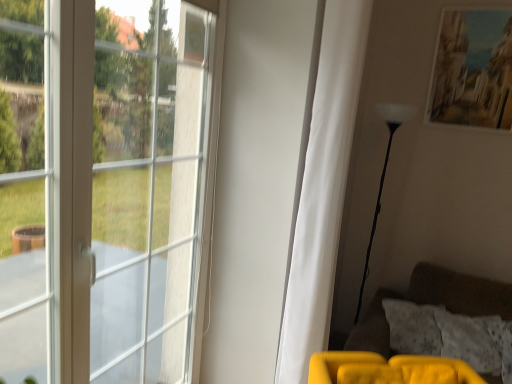
Question: Should I look upward or downward to see white glass window at left?

Choices:
 (A) down
 (B) up

Answer: (A)

Question: Is white glass window at left thinner than white glossy floor lamp at right?

Choices:
 (A) yes
 (B) no

Answer: (A)

Question: Is white glass window at left positioned in front of white glossy floor lamp at right?

Choices:
 (A) no
 (B) yes

Answer: (B)

Question: Is white glass window at left further to the viewer compared to white glossy floor lamp at right?

Choices:
 (A) yes
 (B) no

Answer: (B)

Question: Is white glossy floor lamp at right completely or partially inside white glass window at left?

Choices:
 (A) no
 (B) yes

Answer: (A)

Question: Could you tell me if white glass window at left is facing white glossy floor lamp at right?

Choices:
 (A) yes
 (B) no

Answer: (B)

Question: Considering the relative sizes of white glass window at left and white glossy floor lamp at right in the image provided, is white glass window at left smaller than white glossy floor lamp at right?

Choices:
 (A) yes
 (B) no

Answer: (B)

Question: Does white matte curtain at center contain matte paper picture frame at upper right?

Choices:
 (A) yes
 (B) no

Answer: (B)

Question: Considering the relative sizes of white matte curtain at center and matte paper picture frame at upper right in the image provided, is white matte curtain at center wider than matte paper picture frame at upper right?

Choices:
 (A) no
 (B) yes

Answer: (B)

Question: From the image's perspective, would you say white matte curtain at center is shown under matte paper picture frame at upper right?

Choices:
 (A) yes
 (B) no

Answer: (A)

Question: Is white matte curtain at center closer to the viewer compared to matte paper picture frame at upper right?

Choices:
 (A) no
 (B) yes

Answer: (B)

Question: Considering the relative sizes of white matte curtain at center and matte paper picture frame at upper right in the image provided, is white matte curtain at center smaller than matte paper picture frame at upper right?

Choices:
 (A) yes
 (B) no

Answer: (B)

Question: Does white matte curtain at center have a lesser width compared to matte paper picture frame at upper right?

Choices:
 (A) yes
 (B) no

Answer: (B)

Question: From a real-world perspective, is matte paper picture frame at upper right beneath white matte curtain at center?

Choices:
 (A) no
 (B) yes

Answer: (A)